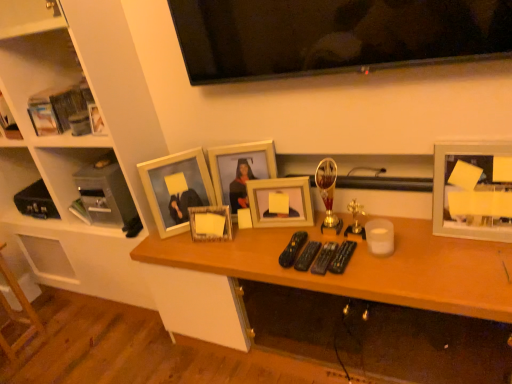
Locate an element on the screen. The width and height of the screenshot is (512, 384). vacant area that is in front of matte wooden picture frame at center, the 4th picture frame from the left is located at coordinates (282, 242).